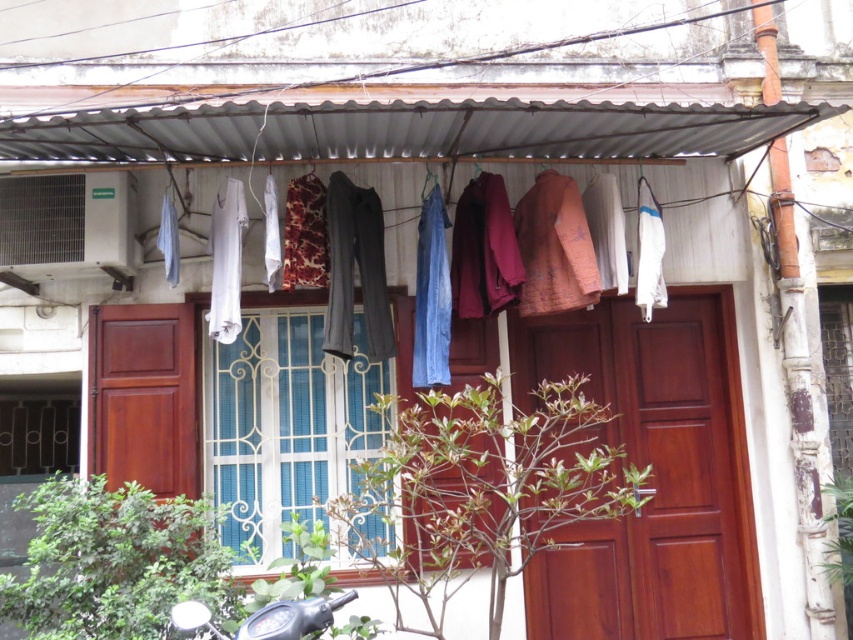
Question: Is blue fabric pants at upper center thinner than metallic silver motorcycle at lower left?

Choices:
 (A) yes
 (B) no

Answer: (B)

Question: Which point is closer to the camera taking this photo?

Choices:
 (A) (250, 284)
 (B) (189, 628)

Answer: (B)

Question: Can you confirm if blue fabric pants at upper center is positioned above metallic silver motorcycle at lower left?

Choices:
 (A) no
 (B) yes

Answer: (B)

Question: Does blue fabric pants at upper center appear under metallic silver motorcycle at lower left?

Choices:
 (A) yes
 (B) no

Answer: (B)

Question: Which of the following is the farthest from the observer?

Choices:
 (A) metallic silver motorcycle at lower left
 (B) blue fabric pants at upper center

Answer: (B)